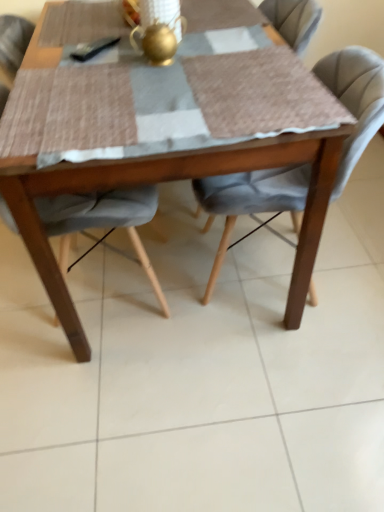
Locate an element on the screen. free point above velvet grey chair at center, positioned as the first chair in right-to-left order (from a real-world perspective) is located at coordinates (258, 75).